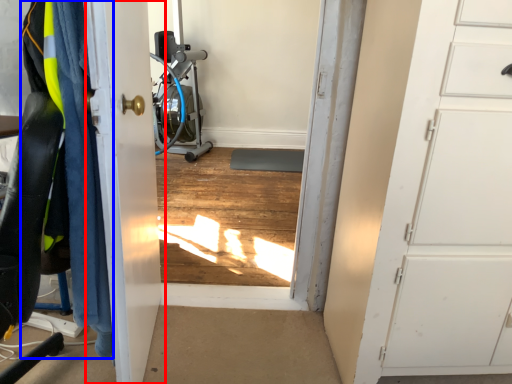
Question: Among these objects, which one is nearest to the camera, door (highlighted by a red box) or clothing (highlighted by a blue box)?

Choices:
 (A) door
 (B) clothing

Answer: (A)